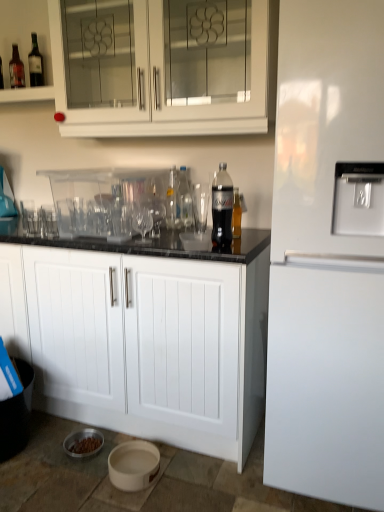
Locate an element on the screen. The height and width of the screenshot is (512, 384). vacant space situated above white matte basin at lower center (from a real-world perspective) is located at coordinates (133, 458).